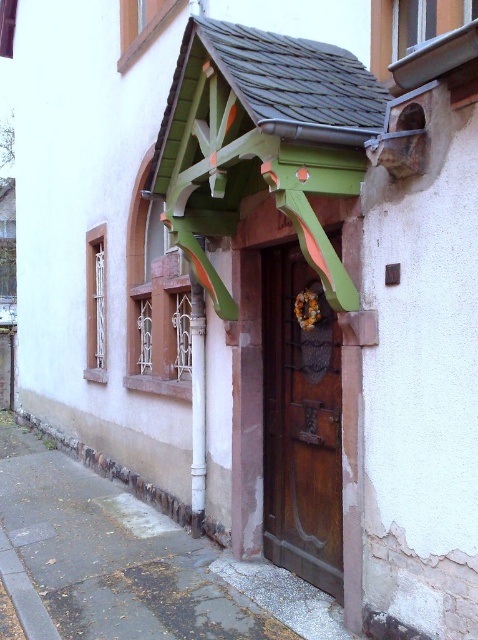
Question: Is brown wooden door at center further to the viewer compared to white painted wood at center?

Choices:
 (A) yes
 (B) no

Answer: (B)

Question: Which object is closer to the camera taking this photo?

Choices:
 (A) brown wooden door at center
 (B) white painted wood at center

Answer: (A)

Question: Can you confirm if brown wooden door at center is thinner than white painted wood at center?

Choices:
 (A) no
 (B) yes

Answer: (A)

Question: Can you confirm if brown wooden door at center is positioned below white painted wood at center?

Choices:
 (A) no
 (B) yes

Answer: (A)

Question: Which point is farther to the camera?

Choices:
 (A) [x=195, y=358]
 (B) [x=265, y=516]

Answer: (A)